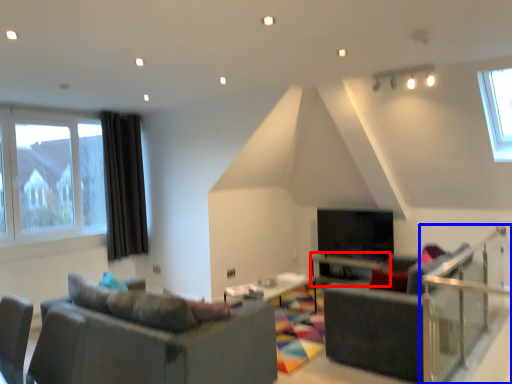
Question: Among these objects, which one is nearest to the camera, table (highlighted by a red box) or balustrade (highlighted by a blue box)?

Choices:
 (A) table
 (B) balustrade

Answer: (B)